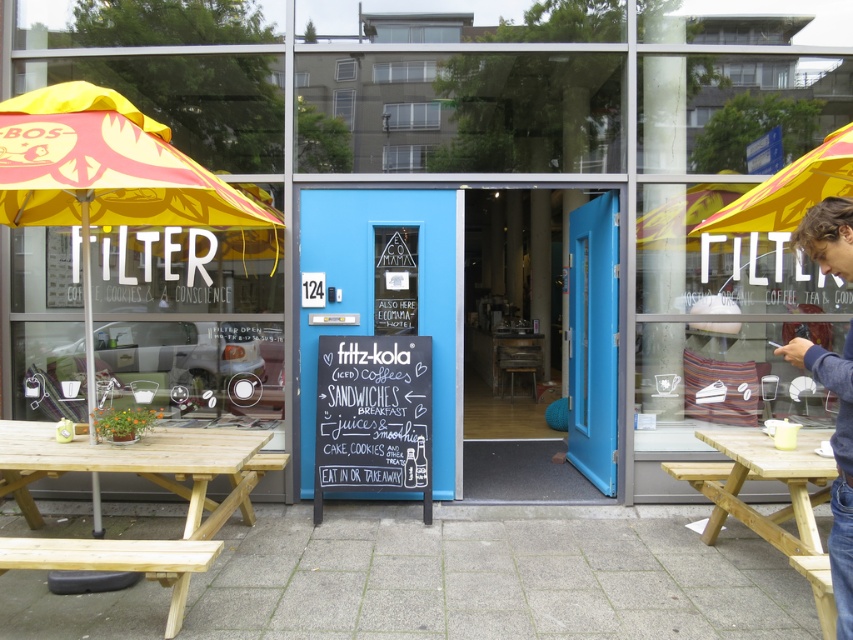
You are standing at the entrance of the FILTER cafe and want to find the yellow fabric umbrella at left. Which direction should you look to find it?

Result: The yellow fabric umbrella at left is located at point (103, 177), so you should look to your left side to find it.